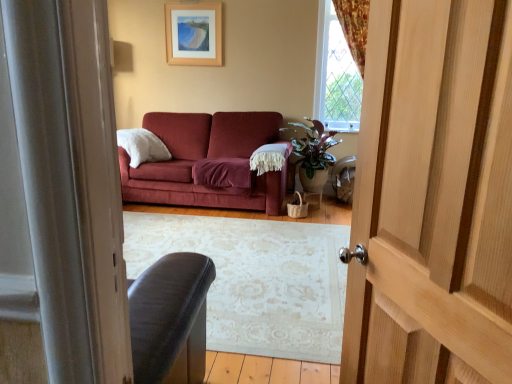
Question: From the image's perspective, is wooden picture frame at upper center below clear glass window at upper right?

Choices:
 (A) yes
 (B) no

Answer: (B)

Question: From the image's perspective, is wooden picture frame at upper center on top of clear glass window at upper right?

Choices:
 (A) no
 (B) yes

Answer: (B)

Question: Is wooden picture frame at upper center wider than clear glass window at upper right?

Choices:
 (A) yes
 (B) no

Answer: (B)

Question: Can you confirm if wooden picture frame at upper center is bigger than clear glass window at upper right?

Choices:
 (A) no
 (B) yes

Answer: (A)

Question: Is wooden picture frame at upper center at the right side of clear glass window at upper right?

Choices:
 (A) yes
 (B) no

Answer: (B)

Question: Would you say wooden picture frame at upper center is to the left or to the right of clear glass window at upper right in the picture?

Choices:
 (A) right
 (B) left

Answer: (B)

Question: Is wooden picture frame at upper center inside or outside of clear glass window at upper right?

Choices:
 (A) inside
 (B) outside

Answer: (B)

Question: From a real-world perspective, is wooden picture frame at upper center above or below clear glass window at upper right?

Choices:
 (A) below
 (B) above

Answer: (B)

Question: From their relative heights in the image, would you say wooden picture frame at upper center is taller or shorter than clear glass window at upper right?

Choices:
 (A) tall
 (B) short

Answer: (B)

Question: Considering the positions of wooden picture frame at upper center and light brown wooden door at right in the image, is wooden picture frame at upper center wider or thinner than light brown wooden door at right?

Choices:
 (A) wide
 (B) thin

Answer: (B)

Question: From the image's perspective, is wooden picture frame at upper center above or below light brown wooden door at right?

Choices:
 (A) above
 (B) below

Answer: (A)

Question: From a real-world perspective, is wooden picture frame at upper center positioned above or below light brown wooden door at right?

Choices:
 (A) below
 (B) above

Answer: (B)

Question: Is wooden picture frame at upper center spatially inside light brown wooden door at right, or outside of it?

Choices:
 (A) outside
 (B) inside

Answer: (A)

Question: Is point (347, 61) positioned closer to the camera than point (357, 201)?

Choices:
 (A) closer
 (B) farther

Answer: (B)

Question: Considering their positions, is clear glass window at upper right located in front of or behind light brown wooden door at right?

Choices:
 (A) front
 (B) behind

Answer: (B)